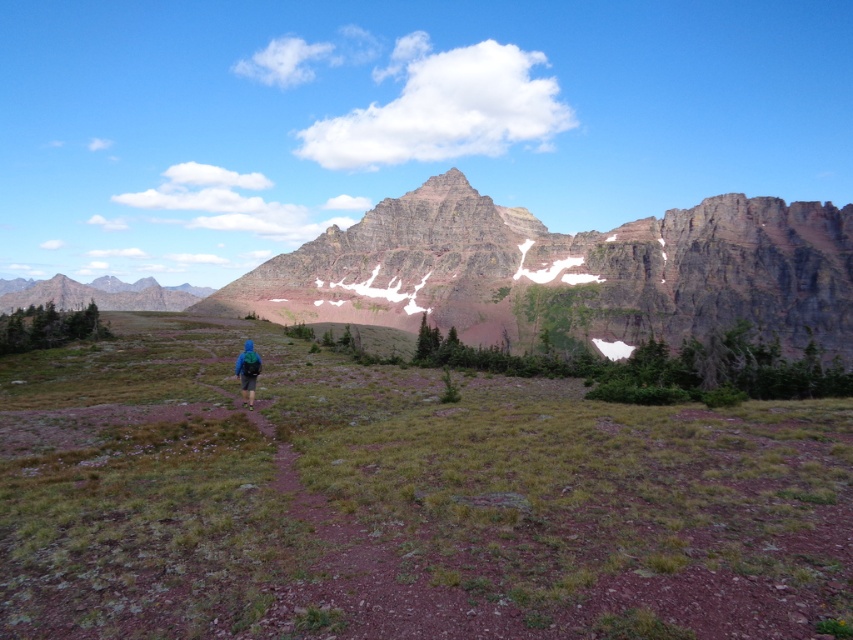
Can you confirm if green grassy mountain at lower left is taller than blue fabric backpack at center?

Yes, green grassy mountain at lower left is taller than blue fabric backpack at center.

Consider the image. Is green grassy mountain at lower left closer to the viewer compared to blue fabric backpack at center?

No, green grassy mountain at lower left is further to the viewer.

Does point (42, 288) come behind point (252, 388)?

Yes.

You are a GUI agent. You are given a task and a screenshot of the screen. Output one action in this format:
    pyautogui.click(x=<x>, y=<y>)
    Task: Click on the green grassy mountain at lower left
    The width and height of the screenshot is (853, 640).
    Given the screenshot: What is the action you would take?
    pyautogui.click(x=97, y=294)

Which of these two, rugged granite mountain at center or blue fabric backpack at center, stands shorter?

Standing shorter between the two is blue fabric backpack at center.

Consider the image. Can you confirm if rugged granite mountain at center is positioned to the left of blue fabric backpack at center?

No, rugged granite mountain at center is not to the left of blue fabric backpack at center.

Does point (728, 195) lie behind point (254, 372)?

Yes, point (728, 195) is farther from viewer.

This screenshot has width=853, height=640. I want to click on rugged granite mountain at center, so click(x=566, y=269).

Can you confirm if rugged granite mountain at center is thinner than green grassy mountain at lower left?

Correct, rugged granite mountain at center's width is less than green grassy mountain at lower left's.

Image resolution: width=853 pixels, height=640 pixels. In order to click on rugged granite mountain at center in this screenshot , I will do `click(566, 269)`.

Find the location of `rugged granite mountain at center`. rugged granite mountain at center is located at coordinates (566, 269).